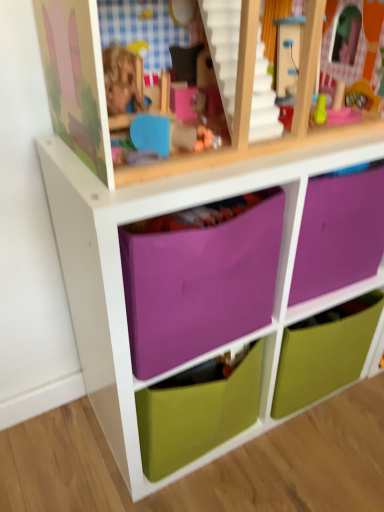
Locate an element on the screen. free point above purple fabric drawer at center, acting as the second drawer starting from the bottom (from a real-world perspective) is located at coordinates (235, 154).